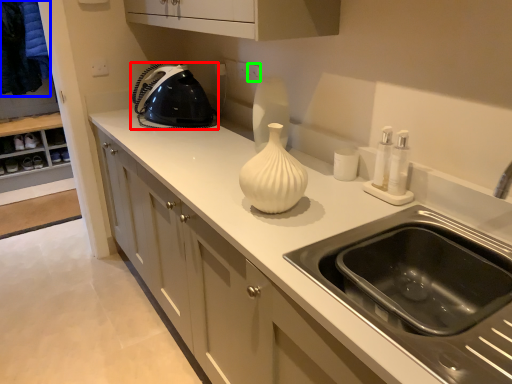
Question: Which is nearer to the home appliance (highlighted by a red box)? laundry (highlighted by a blue box) or electric outlet (highlighted by a green box).

Choices:
 (A) laundry
 (B) electric outlet

Answer: (B)